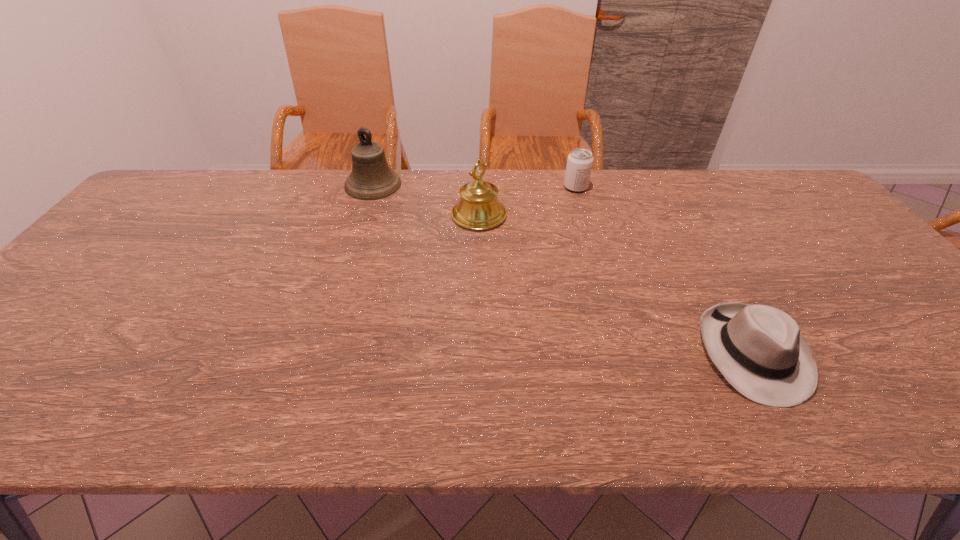
Where is `object located in the near edge section of the desktop`? object located in the near edge section of the desktop is located at coordinates (759, 349).

In the image, there is a desktop. Where is `vacant space at the far edge`? Image resolution: width=960 pixels, height=540 pixels. vacant space at the far edge is located at coordinates (461, 170).

Where is `free space at the near edge of the desktop`? free space at the near edge of the desktop is located at coordinates (203, 390).

Locate an element on the screen. This screenshot has width=960, height=540. vacant space at the right edge of the desktop is located at coordinates (888, 277).

This screenshot has width=960, height=540. I want to click on vacant region at the far left corner of the desktop, so 181,192.

The height and width of the screenshot is (540, 960). What are the coordinates of `vacant region at the far right corner of the desktop` in the screenshot? It's located at (807, 211).

Locate an element on the screen. The image size is (960, 540). free area in between the leftmost object and the third object from right to left is located at coordinates (426, 200).

Where is `vacant region between the soda can and the fedora`? vacant region between the soda can and the fedora is located at coordinates (664, 270).

Where is `vacant area that lies between the shortest object and the right bell`? vacant area that lies between the shortest object and the right bell is located at coordinates (616, 284).

Identify the location of free space between the right bell and the soda can. The image size is (960, 540). (527, 201).